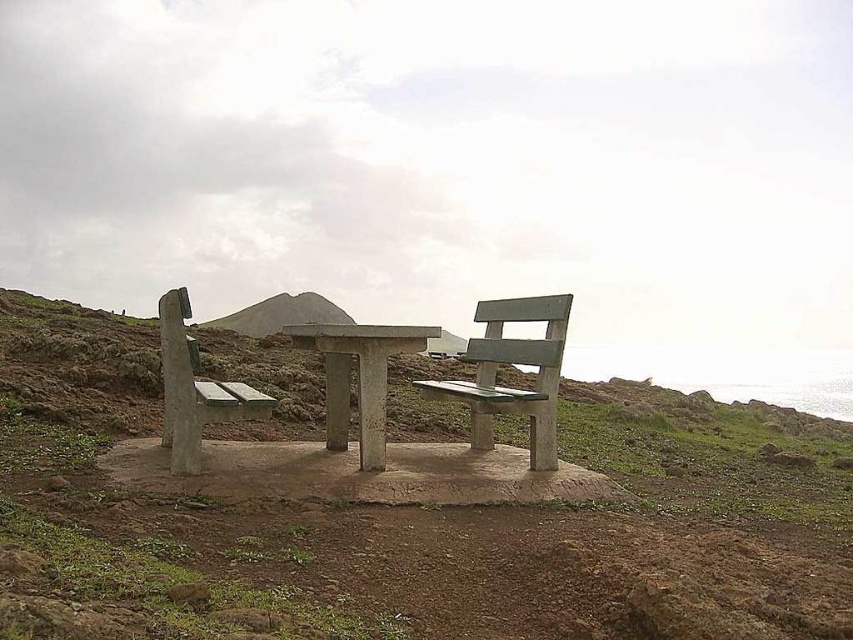
You are standing at the origin point in the image. Which direction should you move to reach the green matte bench at center?

Since the green matte bench at center is located at coordinates point (415,516), you should move towards the right and slightly upward from your current position at the origin to reach it.

You are standing in the outdoor area and want to take a photo of the green matte bench at center and the brushed concrete hillside at center. Which object should you focus on first if you want both to be in sharp focus?

You should focus on the green matte bench at center first because it is closer to the viewer than the brushed concrete hillside at center. By focusing on the closer object, the background object will still be in focus due to the depth of field.